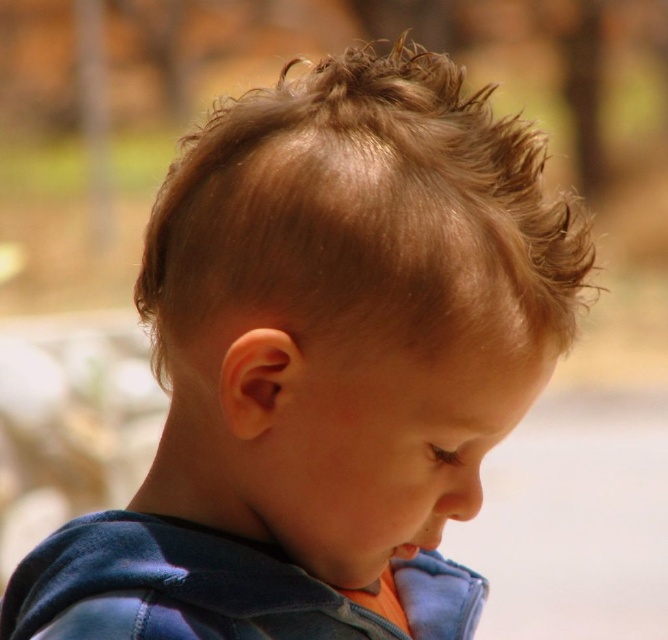
Question: Is light brown textured hair at center below velvet blue sweatshirt at lower left?

Choices:
 (A) no
 (B) yes

Answer: (A)

Question: Does light brown textured hair at center appear on the left side of velvet blue sweatshirt at lower left?

Choices:
 (A) yes
 (B) no

Answer: (A)

Question: Which point appears farthest from the camera in this image?

Choices:
 (A) (546, 330)
 (B) (432, 598)

Answer: (B)

Question: Does light brown textured hair at center lie in front of velvet blue sweatshirt at lower left?

Choices:
 (A) no
 (B) yes

Answer: (B)

Question: Which point is farther from the camera taking this photo?

Choices:
 (A) (403, 145)
 (B) (303, 573)

Answer: (B)